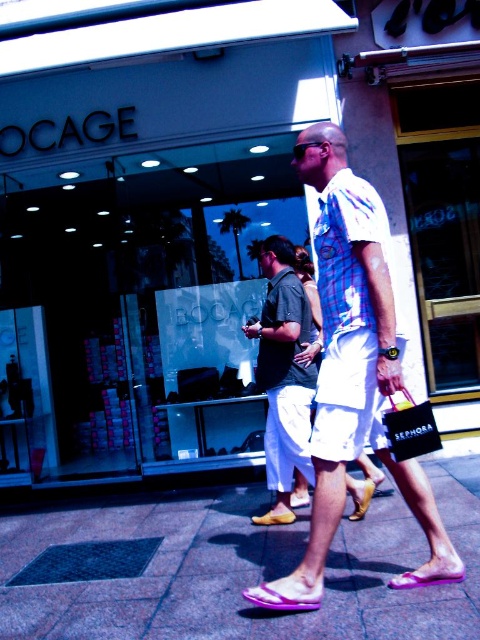
Locate an element on the screen. This screenshot has height=640, width=480. dark gray cotton shirt at center is located at coordinates (284, 369).

In the scene shown: Who is more forward, (288, 336) or (260, 593)?

Positioned in front is point (260, 593).

Is point (312, 365) in front of point (244, 598)?

No, it is behind (244, 598).

Locate an element on the screen. dark gray cotton shirt at center is located at coordinates (284, 369).

Is point (200, 273) in front of point (419, 570)?

No, (200, 273) is behind (419, 570).

Is matte glass storefront at center above purple rubber sandal at lower center?

Correct, matte glass storefront at center is located above purple rubber sandal at lower center.

Is point (241, 266) closer to viewer compared to point (404, 577)?

No.

This screenshot has height=640, width=480. In order to click on matte glass storefront at center in this screenshot , I will do `click(145, 228)`.

Can you confirm if purple rubber sandals at center is smaller than leather tan sandal at lower center?

Actually, purple rubber sandals at center might be larger than leather tan sandal at lower center.

The image size is (480, 640). What do you see at coordinates (242, 572) in the screenshot?
I see `purple rubber sandals at center` at bounding box center [242, 572].

Is point (230, 579) farther from viewer compared to point (295, 518)?

No, it is not.

The height and width of the screenshot is (640, 480). What are the coordinates of `purple rubber sandals at center` in the screenshot? It's located at (242, 572).